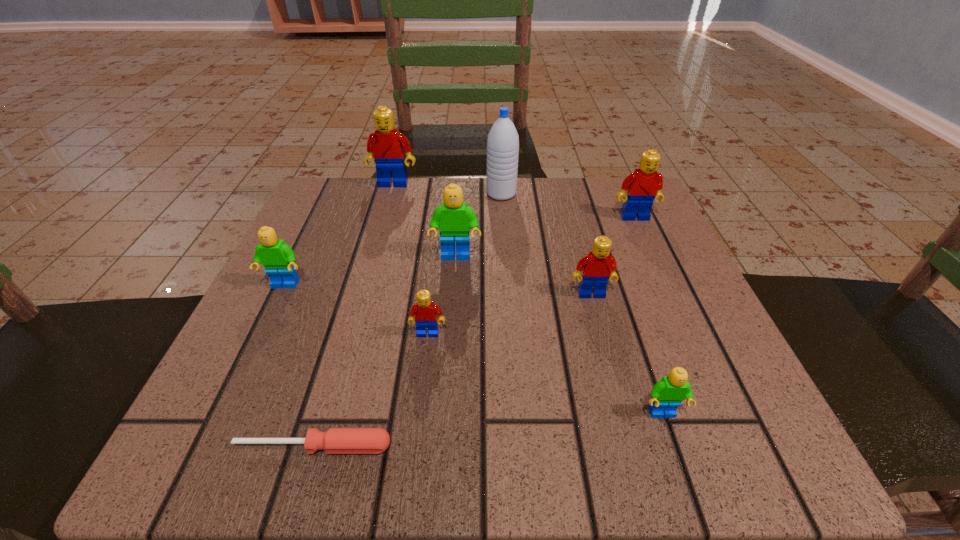
Find the location of a particular element. The width and height of the screenshot is (960, 540). the sixth object from left to right is located at coordinates (503, 140).

Locate an element on the screen. water bottle is located at coordinates (503, 140).

Image resolution: width=960 pixels, height=540 pixels. Find the location of `the sixth Lego from right to left`. the sixth Lego from right to left is located at coordinates tap(386, 147).

Where is `the farthest red Lego`? This screenshot has height=540, width=960. the farthest red Lego is located at coordinates (386, 147).

Where is `the second farthest Lego`? the second farthest Lego is located at coordinates click(x=645, y=184).

At what (x,y) coordinates should I click in order to perform the action: click on the rightmost red Lego. Please return your answer as a coordinate pair (x, y). The image size is (960, 540). Looking at the image, I should click on (645, 184).

At what (x,y) coordinates should I click in order to perform the action: click on the third farthest Lego. Please return your answer as a coordinate pair (x, y). The width and height of the screenshot is (960, 540). Looking at the image, I should click on (x=454, y=219).

At what (x,y) coordinates should I click in order to perform the action: click on the second green Lego from left to right. Please return your answer as a coordinate pair (x, y). This screenshot has height=540, width=960. Looking at the image, I should click on (454, 219).

This screenshot has height=540, width=960. What are the coordinates of `the third biggest red Lego` in the screenshot? It's located at (598, 267).

The width and height of the screenshot is (960, 540). Find the location of `the second red Lego from right to left`. the second red Lego from right to left is located at coordinates (598, 267).